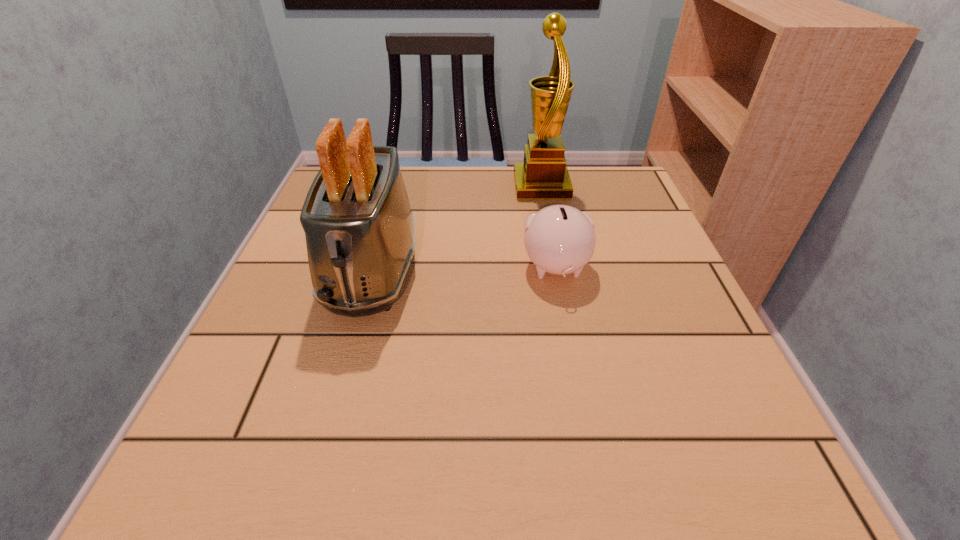
Identify the location of object located at the far edge. This screenshot has height=540, width=960. point(543,175).

The width and height of the screenshot is (960, 540). I want to click on object that is positioned at the left edge, so click(359, 228).

Locate an element on the screen. The height and width of the screenshot is (540, 960). free region at the far edge of the desktop is located at coordinates (435, 166).

The height and width of the screenshot is (540, 960). What are the coordinates of `free space at the left edge of the desktop` in the screenshot? It's located at (299, 287).

Identify the location of vacant region at the right edge of the desktop. The image size is (960, 540). (688, 430).

Image resolution: width=960 pixels, height=540 pixels. In the image, there is a desktop. In order to click on free space at the far right corner in this screenshot , I will do `click(629, 182)`.

Locate an element on the screen. This screenshot has height=540, width=960. free space at the near right corner is located at coordinates coord(742,433).

At what (x,y) coordinates should I click in order to perform the action: click on free space between the second shortest object and the award. Please return your answer as a coordinate pair (x, y). The height and width of the screenshot is (540, 960). Looking at the image, I should click on (457, 228).

Where is `vacant space that is in between the shortest object and the leftmost object`? vacant space that is in between the shortest object and the leftmost object is located at coordinates (464, 269).

The width and height of the screenshot is (960, 540). Identify the location of empty space between the leftmost object and the farthest object. (457, 228).